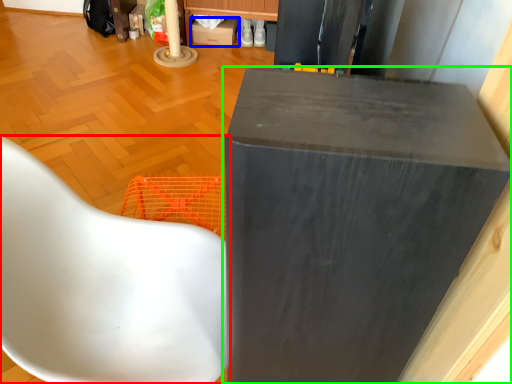
Question: Considering the real-world distances, which object is farthest from chair (highlighted by a red box)? cardboard box (highlighted by a blue box) or furniture (highlighted by a green box)?

Choices:
 (A) cardboard box
 (B) furniture

Answer: (A)